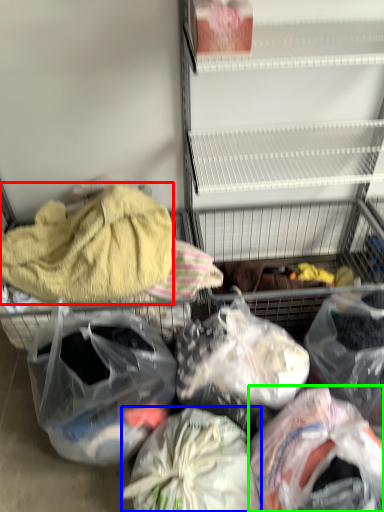
Question: Which object is the closest to the towel/napkin (highlighted by a red box)? Choose among these: plastic bag (highlighted by a blue box) or plastic bag (highlighted by a green box).

Choices:
 (A) plastic bag
 (B) plastic bag

Answer: (A)